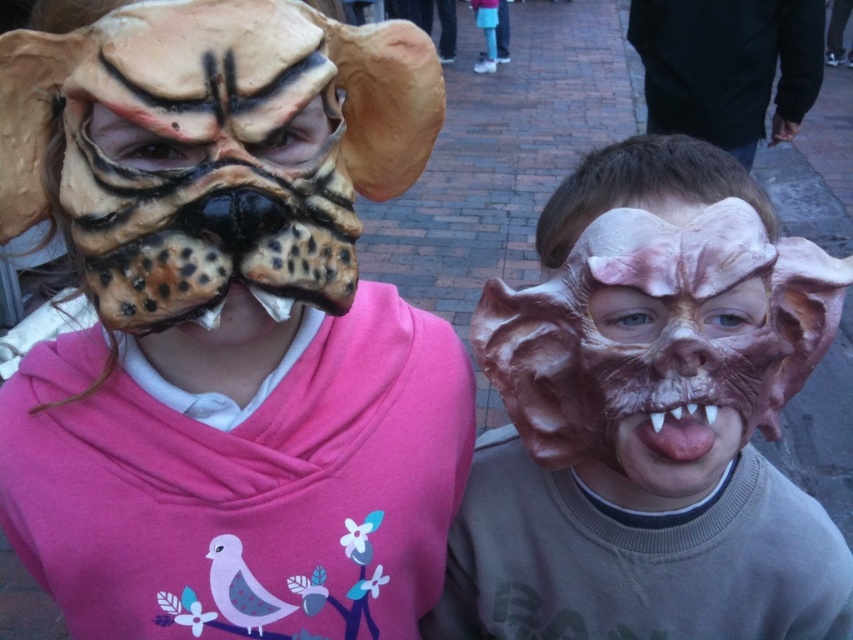
You are standing in front of an art exhibition and see the sculpted rubber mask at center. If you want to touch it, will you be able to reach it without moving closer than 3 feet?

The sculpted rubber mask at center is 3.76 feet away from the viewer. Since 3.76 feet is more than 3 feet, you would need to move closer to reach it.